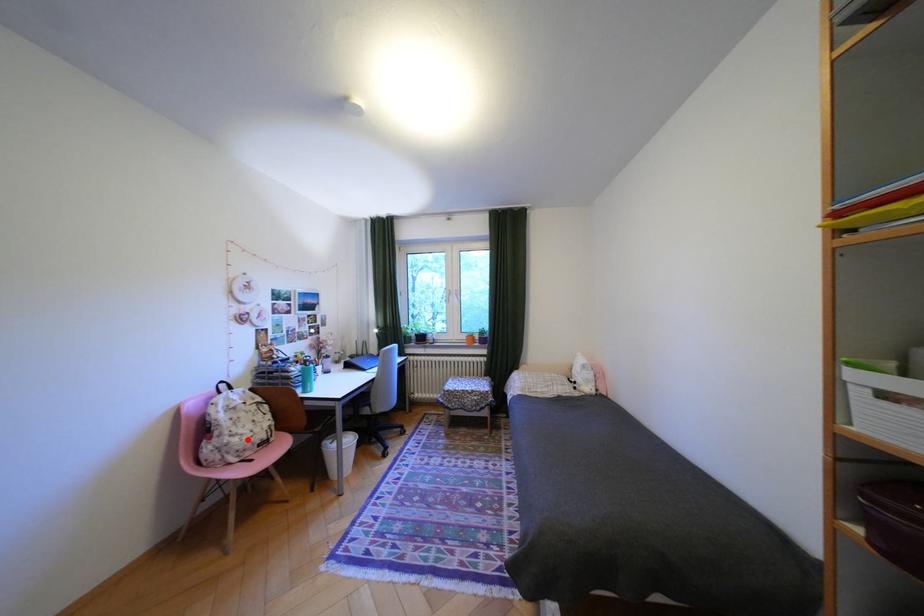
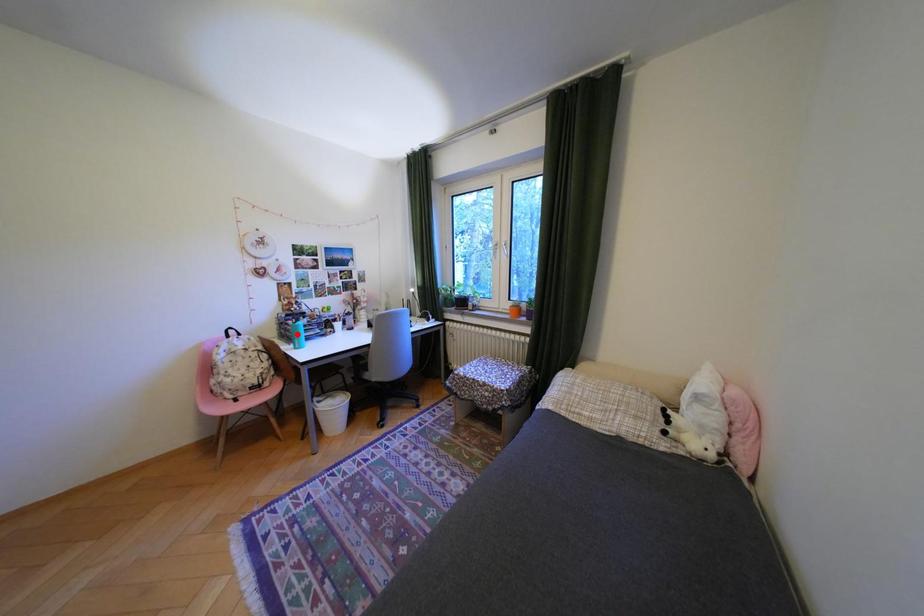
I am providing you with two images of the same scene from different viewpoints. A red point is marked on the first image and another point is marked on the second image. Are the points marked in image1 and image2 representing the same 3D position?

No